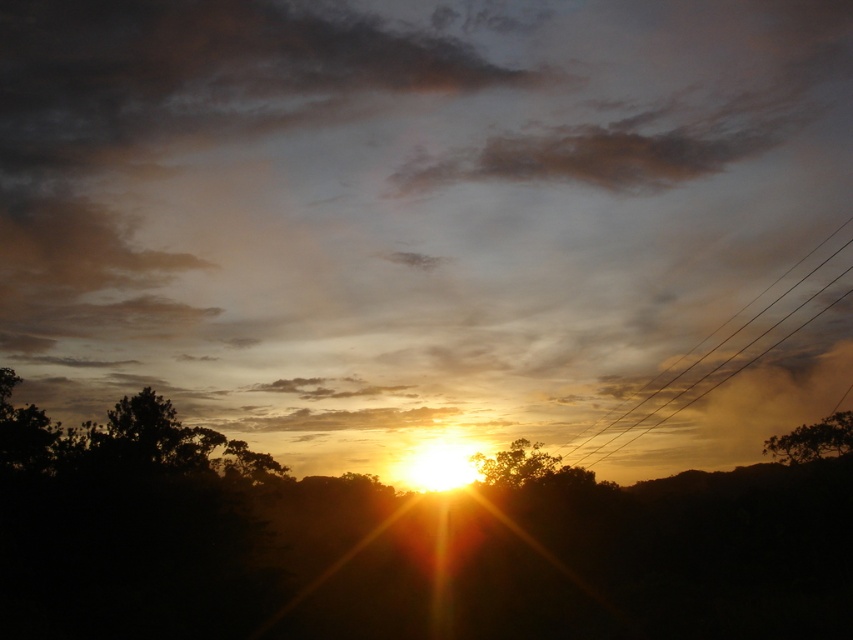
Can you confirm if brown rough tree at right is taller than silhouette leafy tree at center?

Correct, brown rough tree at right is much taller as silhouette leafy tree at center.

Is brown rough tree at right shorter than silhouette leafy tree at center?

No.

Describe the element at coordinates (813, 440) in the screenshot. I see `brown rough tree at right` at that location.

This screenshot has height=640, width=853. Find the location of `brown rough tree at right`. brown rough tree at right is located at coordinates (813, 440).

Can you confirm if matte orange cloud at center is bigger than brown rough tree at right?

Correct, matte orange cloud at center is larger in size than brown rough tree at right.

Between point (322, 138) and point (784, 436), which one is positioned in front?

Point (784, 436) is more forward.

At what (x,y) coordinates should I click in order to perform the action: click on matte orange cloud at center. Please return your answer as a coordinate pair (x, y). Looking at the image, I should click on (401, 205).

Can you confirm if matte orange cloud at center is bigger than metallic wire at right?

Indeed, matte orange cloud at center has a larger size compared to metallic wire at right.

What do you see at coordinates (401, 205) in the screenshot? I see `matte orange cloud at center` at bounding box center [401, 205].

Is point (103, 35) less distant than point (775, 307)?

Yes, point (103, 35) is in front of point (775, 307).

The height and width of the screenshot is (640, 853). Find the location of `matte orange cloud at center`. matte orange cloud at center is located at coordinates (401, 205).